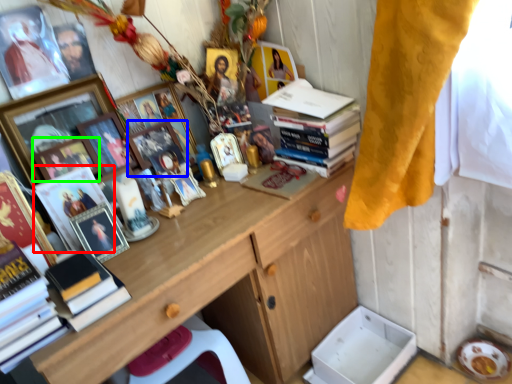
Question: Which object is the farthest from magazine (highlighted by a red box)? Choose among these: picture frame (highlighted by a blue box) or picture frame (highlighted by a green box).

Choices:
 (A) picture frame
 (B) picture frame

Answer: (A)